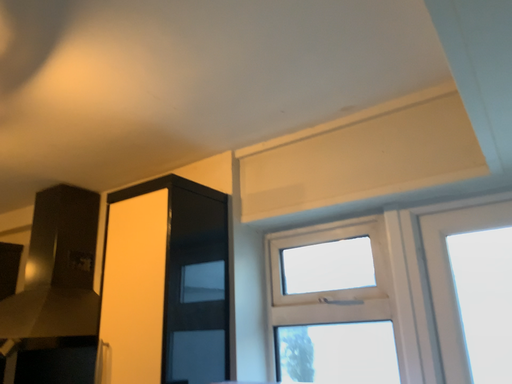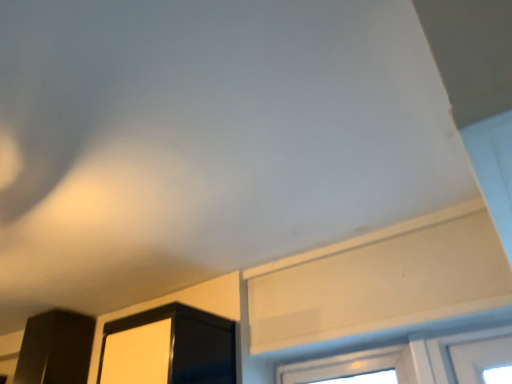
Question: Which way did the camera rotate in the video?

Choices:
 (A) rotated upward
 (B) rotated downward

Answer: (A)